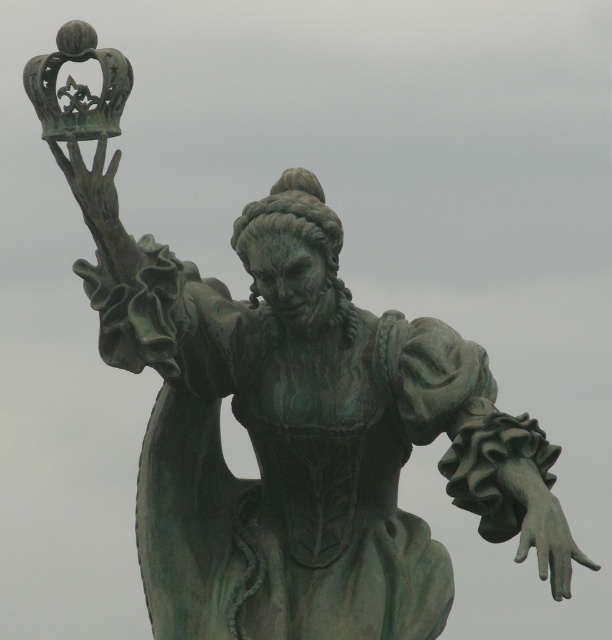
You are an art conservator examining the statue. You notice a green patina hand at lower right. Where exactly is this feature located on the statue?

The green patina hand at lower right is located at point (545, 531) on the statue.

You are an art conservator examining the statue. You notice the green patina hand at lower right and the green patina crown at upper left. Which object is located to the right of the other?

The green patina hand at lower right is positioned on the right side of green patina crown at upper left.